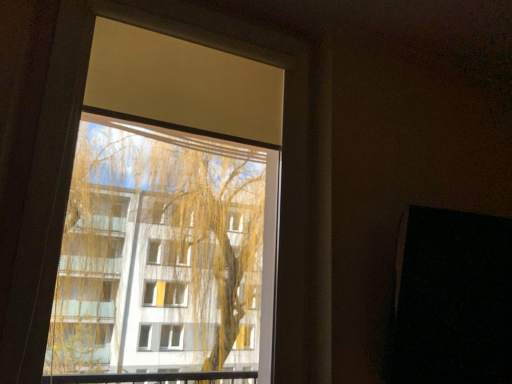
Question: From a real-world perspective, relative to transparent glass window at upper center, is black matte screen door at right vertically above or below?

Choices:
 (A) above
 (B) below

Answer: (B)

Question: Based on their positions, is black matte screen door at right located to the left or right of transparent glass window at upper center?

Choices:
 (A) right
 (B) left

Answer: (A)

Question: From the image's perspective, relative to transparent glass window at upper center, is black matte screen door at right above or below?

Choices:
 (A) below
 (B) above

Answer: (A)

Question: Considering the positions of transparent glass window at upper center and black matte screen door at right in the image, is transparent glass window at upper center wider or thinner than black matte screen door at right?

Choices:
 (A) thin
 (B) wide

Answer: (A)

Question: Is transparent glass window at upper center taller or shorter than black matte screen door at right?

Choices:
 (A) tall
 (B) short

Answer: (A)

Question: From the image's perspective, is transparent glass window at upper center positioned above or below black matte screen door at right?

Choices:
 (A) below
 (B) above

Answer: (B)

Question: Is transparent glass window at upper center inside or outside of black matte screen door at right?

Choices:
 (A) inside
 (B) outside

Answer: (B)